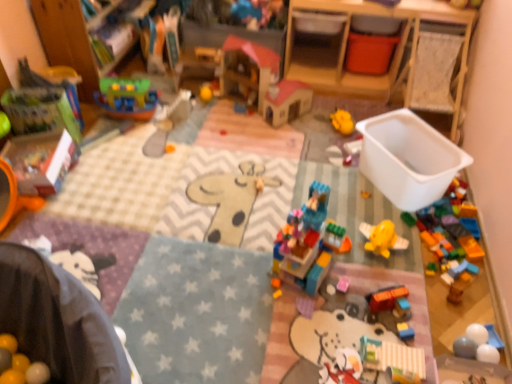
Locate an element on the screen. Image resolution: width=512 pixels, height=384 pixels. vacant area that lies between orange matte car at center, arranged as the ninth toy when viewed from the top, and translucent plastic castle at center, the 8th toy from the top is located at coordinates (353, 288).